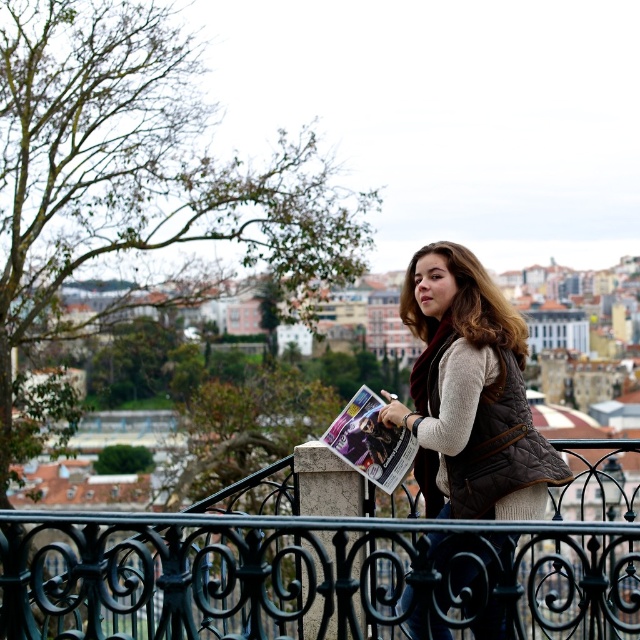
Does point (468, 401) come in front of point (333, 433)?

Yes, point (468, 401) is in front of point (333, 433).

Does brown quilted vest at center appear on the left side of matte paper magazine at center?

Incorrect, brown quilted vest at center is not on the left side of matte paper magazine at center.

Find the location of `brown quilted vest at center`. brown quilted vest at center is located at coordinates (470, 394).

Locate an element on the screen. brown quilted vest at center is located at coordinates (470, 394).

Is point (19, 611) in front of point (358, 392)?

Yes, point (19, 611) is in front of point (358, 392).

Does black wrought iron fence at center have a greater width compared to matte paper magazine at center?

Yes, black wrought iron fence at center is wider than matte paper magazine at center.

Who is more distant from viewer, [355,531] or [397,476]?

The point [397,476] is more distant.

Where is `black wrought iron fence at center`? The height and width of the screenshot is (640, 640). black wrought iron fence at center is located at coordinates (305, 576).

Based on the photo, does black wrought iron fence at center have a smaller size compared to brown quilted vest at center?

No, black wrought iron fence at center is not smaller than brown quilted vest at center.

Who is more forward, (374,529) or (556,481)?

Point (374,529) is more forward.

Find the location of `black wrought iron fence at center`. black wrought iron fence at center is located at coordinates (305, 576).